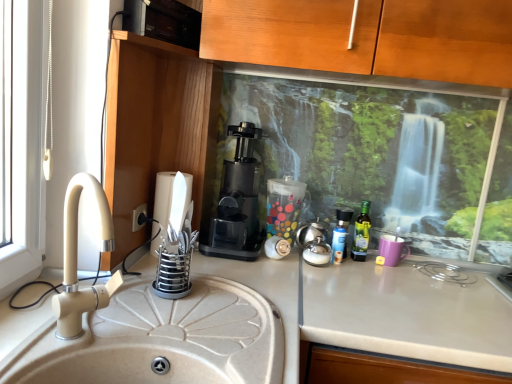
Question: Does white matte countertop at center turn towards beige ceramic sink at left?

Choices:
 (A) yes
 (B) no

Answer: (B)

Question: Is beige ceramic sink at left a part of white matte countertop at center?

Choices:
 (A) no
 (B) yes

Answer: (A)

Question: Is white matte countertop at center closer to the viewer compared to beige ceramic sink at left?

Choices:
 (A) yes
 (B) no

Answer: (B)

Question: Is white matte countertop at center shorter than beige ceramic sink at left?

Choices:
 (A) no
 (B) yes

Answer: (A)

Question: Considering the relative positions of white matte countertop at center and beige ceramic sink at left in the image provided, is white matte countertop at center to the left of beige ceramic sink at left from the viewer's perspective?

Choices:
 (A) no
 (B) yes

Answer: (A)

Question: Is point (371, 278) closer or farther from the camera than point (140, 215)?

Choices:
 (A) closer
 (B) farther

Answer: (B)

Question: From a real-world perspective, relative to black plastic electric outlet at lower left, is white matte countertop at center vertically above or below?

Choices:
 (A) above
 (B) below

Answer: (B)

Question: Is white matte countertop at center situated inside black plastic electric outlet at lower left or outside?

Choices:
 (A) outside
 (B) inside

Answer: (A)

Question: Is white matte countertop at center bigger or smaller than black plastic electric outlet at lower left?

Choices:
 (A) big
 (B) small

Answer: (A)

Question: In terms of width, does beige ceramic sink at left look wider or thinner when compared to black plastic coffee machine at center?

Choices:
 (A) wide
 (B) thin

Answer: (B)

Question: Based on their positions, is beige ceramic sink at left located to the left or right of black plastic coffee machine at center?

Choices:
 (A) right
 (B) left

Answer: (B)

Question: Is beige ceramic sink at left taller or shorter than black plastic coffee machine at center?

Choices:
 (A) tall
 (B) short

Answer: (B)

Question: Considering the positions of point (231, 327) and point (236, 150), is point (231, 327) closer or farther from the camera than point (236, 150)?

Choices:
 (A) closer
 (B) farther

Answer: (A)

Question: Is translucent plastic spray can at center, the first bottle in the left-to-right sequence, taller or shorter than metallic silver knife block at left?

Choices:
 (A) tall
 (B) short

Answer: (B)

Question: Considering the relative positions of translucent plastic spray can at center, acting as the second bottle starting from the right, and metallic silver knife block at left in the image provided, is translucent plastic spray can at center, acting as the second bottle starting from the right, to the left or to the right of metallic silver knife block at left?

Choices:
 (A) right
 (B) left

Answer: (A)